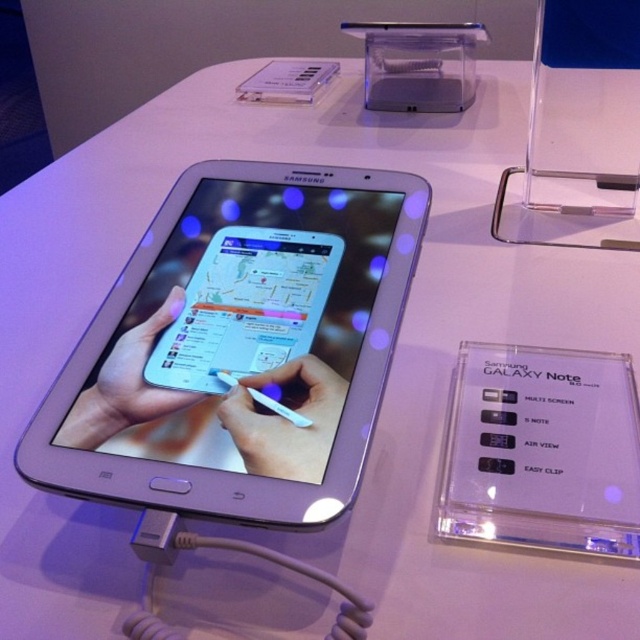
Does silver metallic tablet at center have a lesser width compared to clear plastic samsung galaxy note at center?

No, silver metallic tablet at center is not thinner than clear plastic samsung galaxy note at center.

The height and width of the screenshot is (640, 640). I want to click on silver metallic tablet at center, so click(237, 346).